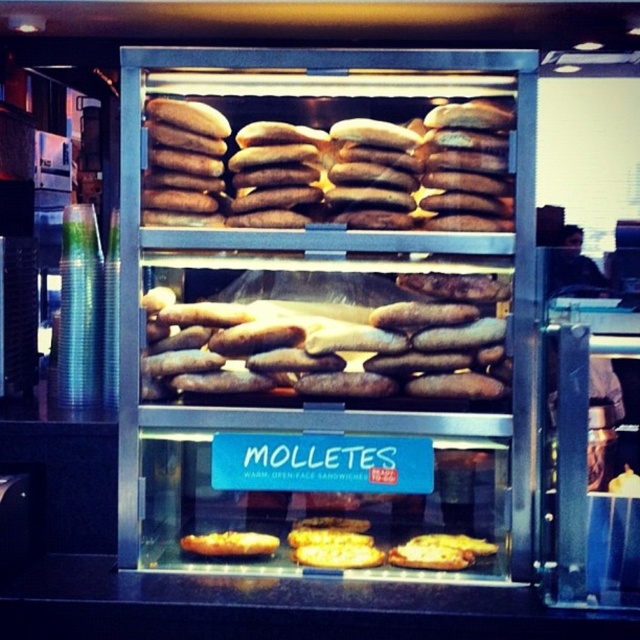
Question: Does brown matte bread at center have a smaller size compared to golden brown bread at lower center?

Choices:
 (A) yes
 (B) no

Answer: (B)

Question: Which object is closer to the camera taking this photo?

Choices:
 (A) brown matte baguette at center
 (B) brown matte bread at center

Answer: (A)

Question: Which point appears farthest from the camera in this image?

Choices:
 (A) (307, 310)
 (B) (500, 205)

Answer: (A)

Question: Observing the image, what is the correct spatial positioning of brown matte bread at center in reference to golden brown bread at lower center?

Choices:
 (A) above
 (B) below

Answer: (A)

Question: Does brown matte bread at center appear under brown matte baguette at center?

Choices:
 (A) no
 (B) yes

Answer: (A)

Question: Which object is farther from the camera taking this photo?

Choices:
 (A) golden brown bread at lower center
 (B) brown matte baguette at center
 (C) brown matte bread at center

Answer: (A)